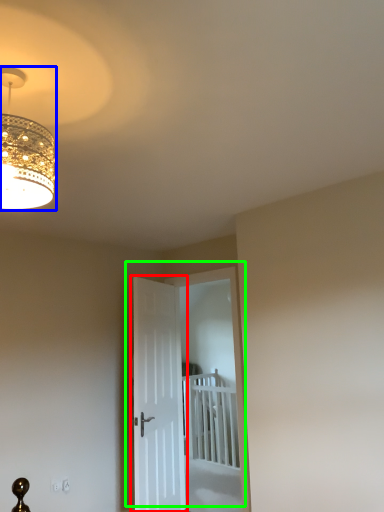
Question: Estimate the real-world distances between objects in this image. Which object is closer to door (highlighted by a red box), lamp (highlighted by a blue box) or door (highlighted by a green box)?

Choices:
 (A) lamp
 (B) door

Answer: (A)